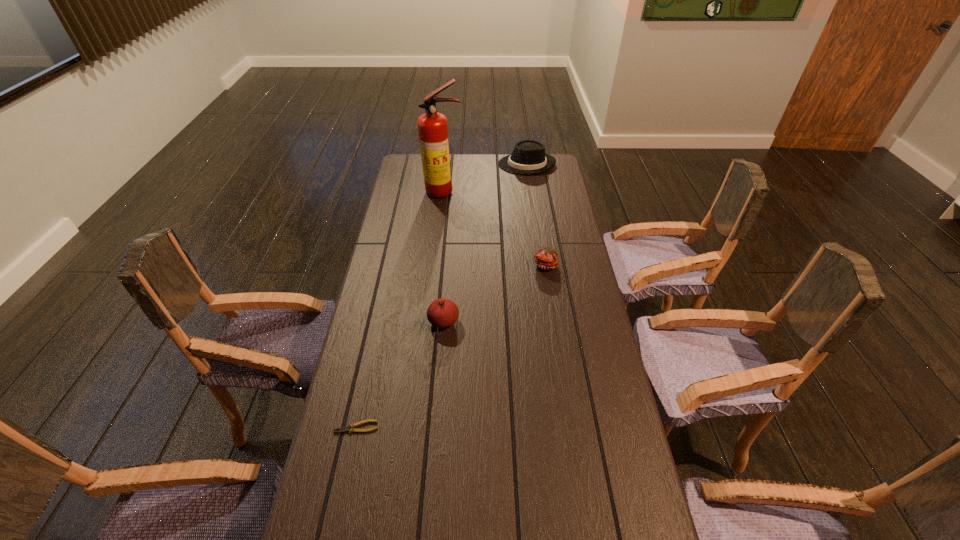
This screenshot has width=960, height=540. I want to click on tomato located in the right edge section of the desktop, so click(545, 258).

What are the coordinates of `object that is at the far right corner` in the screenshot? It's located at (528, 157).

The width and height of the screenshot is (960, 540). In the image, there is a desktop. What are the coordinates of `free space at the far edge` in the screenshot? It's located at (503, 172).

In the image, there is a desktop. Where is `vacant space at the left edge`? The width and height of the screenshot is (960, 540). vacant space at the left edge is located at coordinates (405, 306).

Identify the location of free space at the far left corner of the desktop. (418, 161).

Where is `free space that is in between the right tomato and the leftmost object`? The width and height of the screenshot is (960, 540). free space that is in between the right tomato and the leftmost object is located at coordinates (451, 346).

Find the location of a particular element. Image resolution: width=960 pixels, height=540 pixels. free space between the nearest object and the farther tomato is located at coordinates (451, 346).

Where is `vacant area between the shortest object and the shorter tomato`? vacant area between the shortest object and the shorter tomato is located at coordinates (451, 346).

This screenshot has height=540, width=960. What are the coordinates of `vacant area that lies between the leftmost object and the second farthest object` in the screenshot? It's located at (400, 309).

Locate an element on the screen. The width and height of the screenshot is (960, 540). free space between the left tomato and the second farthest object is located at coordinates (444, 256).